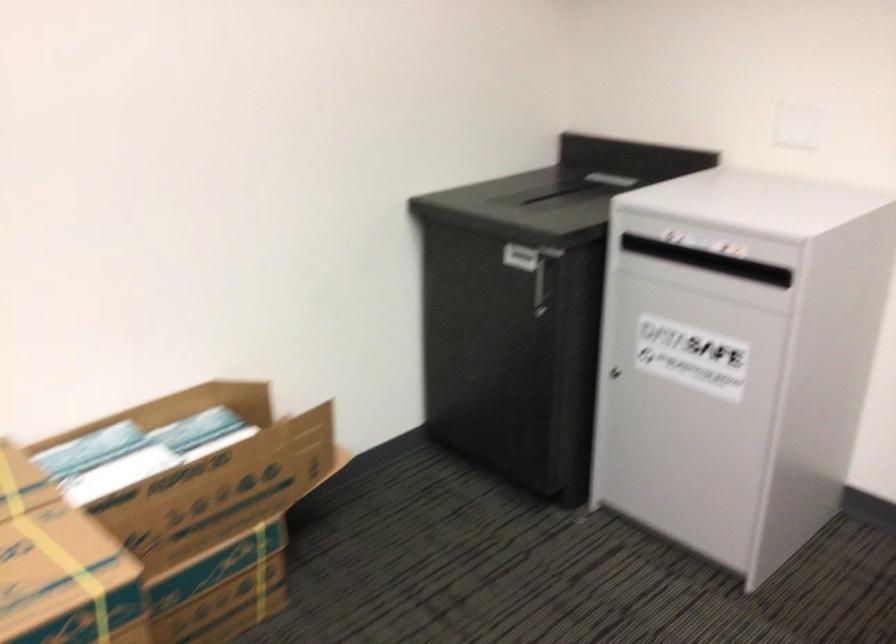
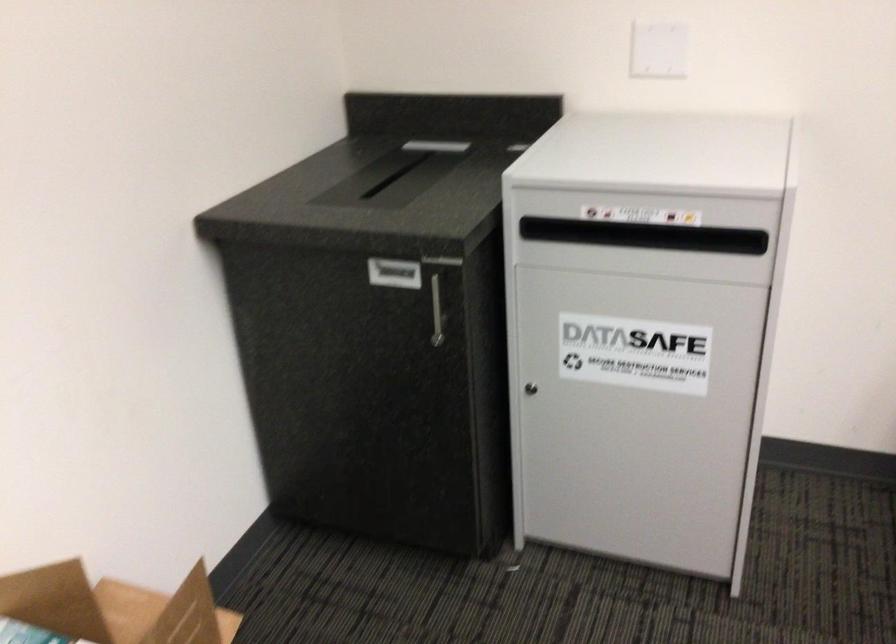
What movement of the cameraman would produce the second image?

The cameraman walked toward left, forward.